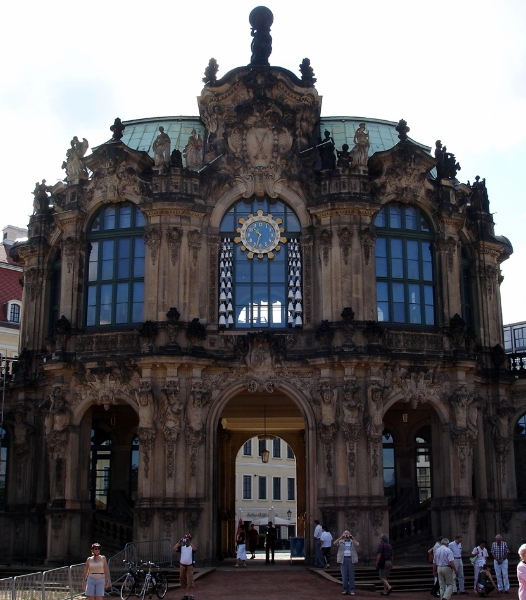
This screenshot has width=526, height=600. I want to click on windows, so click(258, 272), click(121, 272), click(393, 266), click(14, 309), click(246, 487).